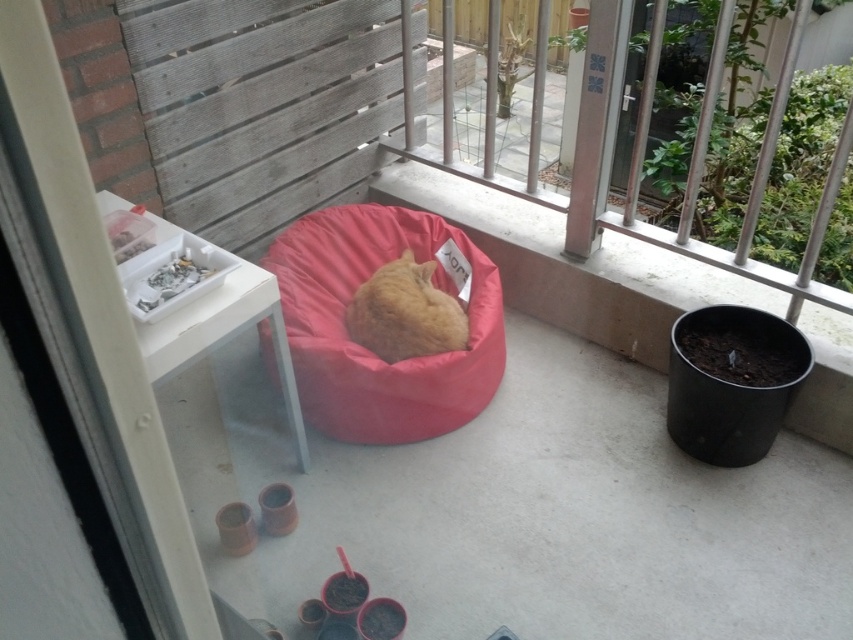
Can you confirm if pink fabric bean bag at center is positioned above orange soft fur cat at center?

Incorrect, pink fabric bean bag at center is not positioned above orange soft fur cat at center.

Does pink fabric bean bag at center lie in front of orange soft fur cat at center?

Yes.

The image size is (853, 640). Describe the element at coordinates (367, 349) in the screenshot. I see `pink fabric bean bag at center` at that location.

The height and width of the screenshot is (640, 853). Identify the location of pink fabric bean bag at center. (367, 349).